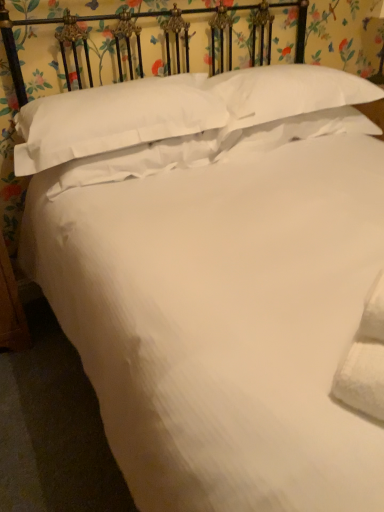
Question: Could you tell me if white soft pillow at upper center, the 3th pillow in the left-to-right sequence, is facing white soft pillow at upper center, the 4th pillow when ordered from left to right?

Choices:
 (A) yes
 (B) no

Answer: (B)

Question: Is the position of white soft pillow at upper center, the 3th pillow in the left-to-right sequence, more distant than that of white soft pillow at upper center, the 4th pillow when ordered from left to right?

Choices:
 (A) no
 (B) yes

Answer: (B)

Question: Are white soft pillow at upper center, which is the second pillow in right-to-left order, and white soft pillow at upper center, positioned as the 1th pillow in right-to-left order, making contact?

Choices:
 (A) no
 (B) yes

Answer: (A)

Question: Is white soft pillow at upper center, the 3th pillow in the left-to-right sequence, looking in the opposite direction of white soft pillow at upper center, the 4th pillow when ordered from left to right?

Choices:
 (A) yes
 (B) no

Answer: (B)

Question: Is white soft pillow at upper center, which is the second pillow in right-to-left order, completely or partially outside of white soft pillow at upper center, the 4th pillow when ordered from left to right?

Choices:
 (A) yes
 (B) no

Answer: (A)

Question: Considering the positions of white soft pillow at center, which is the 3th pillow in right-to-left order, and white cotton pillow at upper center, acting as the first pillow starting from the left, in the image, is white soft pillow at center, which is the 3th pillow in right-to-left order, bigger or smaller than white cotton pillow at upper center, acting as the first pillow starting from the left,?

Choices:
 (A) small
 (B) big

Answer: (A)

Question: Considering the relative positions of white soft pillow at center, which ranks as the second pillow in left-to-right order, and white cotton pillow at upper center, acting as the first pillow starting from the left, in the image provided, is white soft pillow at center, which ranks as the second pillow in left-to-right order, to the left or to the right of white cotton pillow at upper center, acting as the first pillow starting from the left,?

Choices:
 (A) left
 (B) right

Answer: (B)

Question: Considering their positions, is white soft pillow at center, which is the 3th pillow in right-to-left order, located in front of or behind white cotton pillow at upper center, which is counted as the 4th pillow, starting from the right?

Choices:
 (A) behind
 (B) front

Answer: (A)

Question: Choose the correct answer: Is white soft pillow at center, which is the 3th pillow in right-to-left order, inside white cotton pillow at upper center, which is counted as the 4th pillow, starting from the right, or outside it?

Choices:
 (A) inside
 (B) outside

Answer: (A)

Question: Is white soft pillow at center, which ranks as the second pillow in left-to-right order, in front of or behind white soft pillow at upper center, the 3th pillow in the left-to-right sequence, in the image?

Choices:
 (A) behind
 (B) front

Answer: (B)

Question: Does point (170, 141) appear closer or farther from the camera than point (244, 150)?

Choices:
 (A) farther
 (B) closer

Answer: (B)

Question: Which is correct: white soft pillow at center, which ranks as the second pillow in left-to-right order, is inside white soft pillow at upper center, the 3th pillow in the left-to-right sequence, or outside of it?

Choices:
 (A) inside
 (B) outside

Answer: (B)

Question: In terms of height, does white soft pillow at center, which is the 3th pillow in right-to-left order, look taller or shorter compared to white soft pillow at upper center, which is the second pillow in right-to-left order?

Choices:
 (A) tall
 (B) short

Answer: (B)

Question: Is point (221, 152) positioned closer to the camera than point (352, 82)?

Choices:
 (A) farther
 (B) closer

Answer: (B)

Question: Is white soft pillow at center, which ranks as the second pillow in left-to-right order, inside the boundaries of white soft pillow at upper center, the 4th pillow when ordered from left to right, or outside?

Choices:
 (A) outside
 (B) inside

Answer: (A)